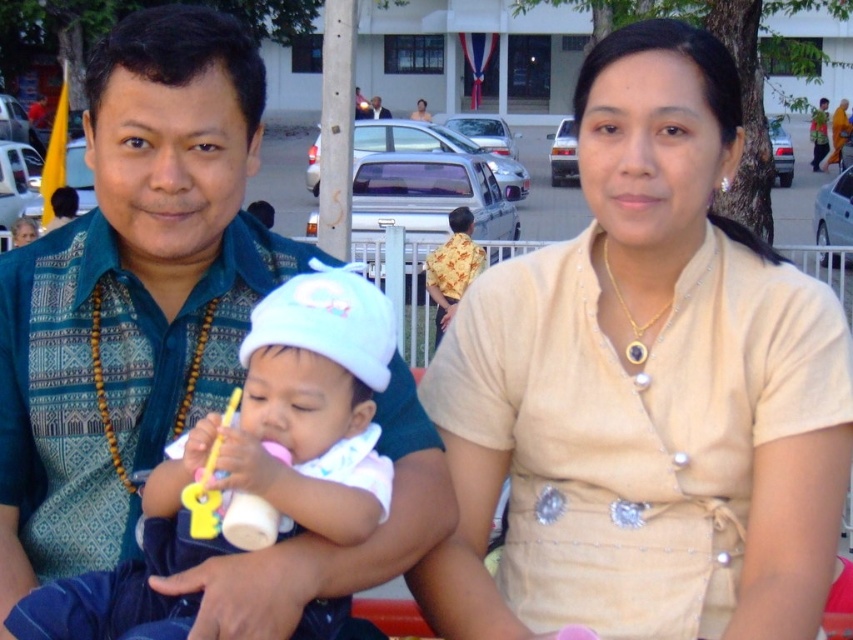
Is blue patterned shirt at left positioned at the back of yellow plastic toy at center?

Yes, it is.

Is blue patterned shirt at left taller than yellow plastic toy at center?

Indeed, blue patterned shirt at left has a greater height compared to yellow plastic toy at center.

Which is behind, point (120, 310) or point (212, 497)?

The point (120, 310) is more distant.

At what (x,y) coordinates should I click in order to perform the action: click on blue patterned shirt at left. Please return your answer as a coordinate pair (x, y). This screenshot has height=640, width=853. Looking at the image, I should click on (132, 289).

Is point (659, 76) farther from camera compared to point (115, 192)?

Yes, point (659, 76) is behind point (115, 192).

Describe the element at coordinates (643, 390) in the screenshot. I see `beige fabric blouse at center` at that location.

I want to click on beige fabric blouse at center, so click(643, 390).

Which of these two, beige fabric blouse at center or yellow plastic toy at center, stands taller?

With more height is beige fabric blouse at center.

Is beige fabric blouse at center in front of yellow plastic toy at center?

No, beige fabric blouse at center is behind yellow plastic toy at center.

Who is more forward, (x=579, y=291) or (x=230, y=518)?

Point (x=230, y=518) is in front.

Identify the location of beige fabric blouse at center. This screenshot has width=853, height=640. (643, 390).